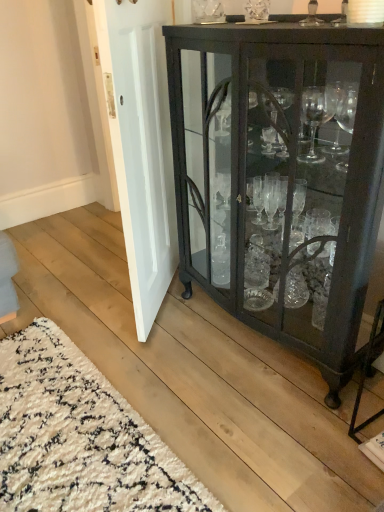
Where is `vacant space that's between matte black cabinet at right and white painted wood door at center`? The height and width of the screenshot is (512, 384). vacant space that's between matte black cabinet at right and white painted wood door at center is located at coordinates 208,357.